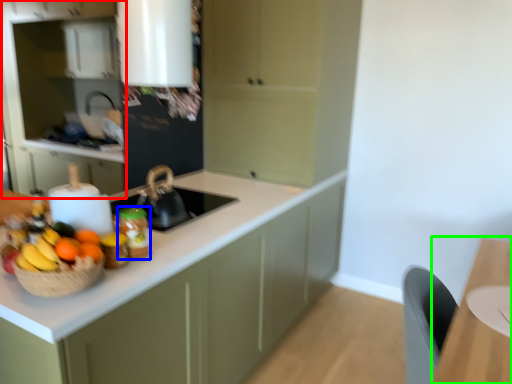
Question: Which object is positioned farthest from cabinetry (highlighted by a red box)? Select from kitchen appliance (highlighted by a blue box) and table (highlighted by a green box).

Choices:
 (A) kitchen appliance
 (B) table

Answer: (B)